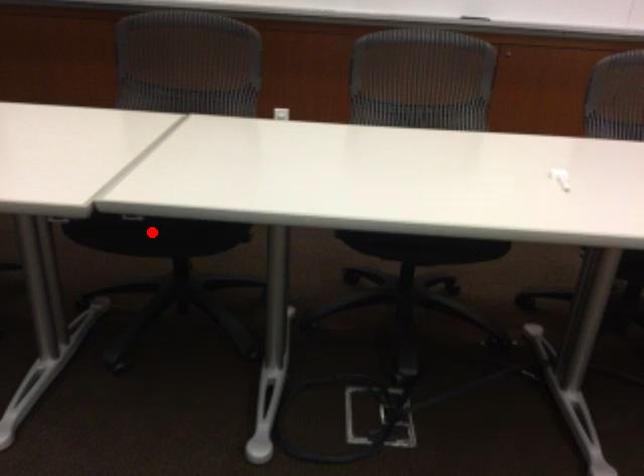
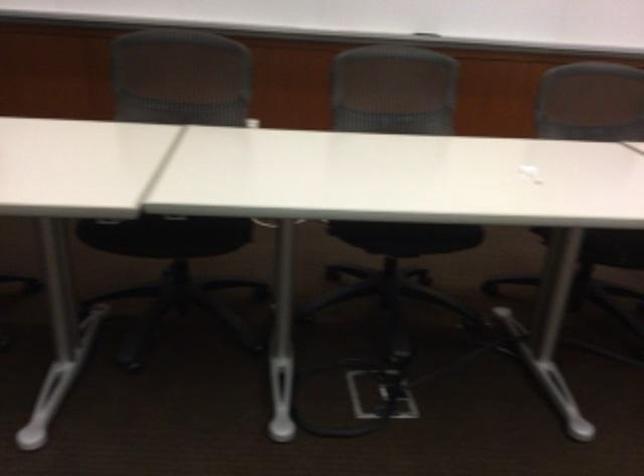
The point at the highlighted location is marked in the first image. Where is the corresponding point in the second image?

(166, 235)